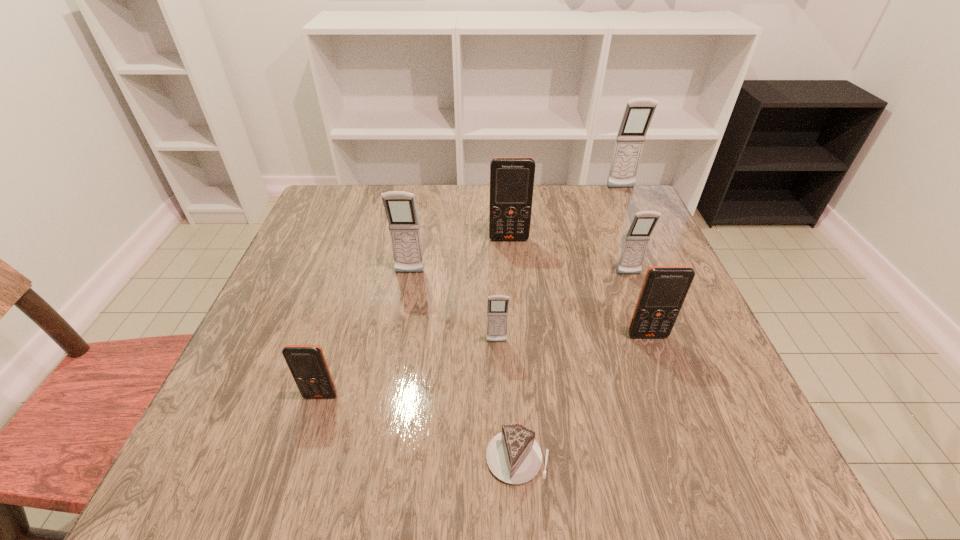
Locate an element on the screen. the biggest gray cellular telephone is located at coordinates (638, 114).

Identify the location of the rightmost gray cellular telephone. (638, 114).

Find the location of a particular element. This screenshot has width=960, height=540. the second cellular telephone from left to right is located at coordinates (400, 207).

At what (x,y) coordinates should I click in order to perform the action: click on the leftmost gray cellular telephone. Please return your answer as a coordinate pair (x, y). The width and height of the screenshot is (960, 540). Looking at the image, I should click on click(x=400, y=207).

Where is `the biggest orange cellular telephone`? the biggest orange cellular telephone is located at coordinates (511, 178).

The image size is (960, 540). I want to click on the second orange cellular telephone from left to right, so click(511, 178).

Locate an element on the screen. the third gray cellular telephone from left to right is located at coordinates (636, 241).

Find the location of a particular element. Image resolution: width=960 pixels, height=540 pixels. the second nearest orange cellular telephone is located at coordinates (664, 289).

This screenshot has height=540, width=960. Find the location of `the rightmost orange cellular telephone`. the rightmost orange cellular telephone is located at coordinates (664, 289).

Locate an element on the screen. The image size is (960, 540). the leftmost object is located at coordinates (307, 363).